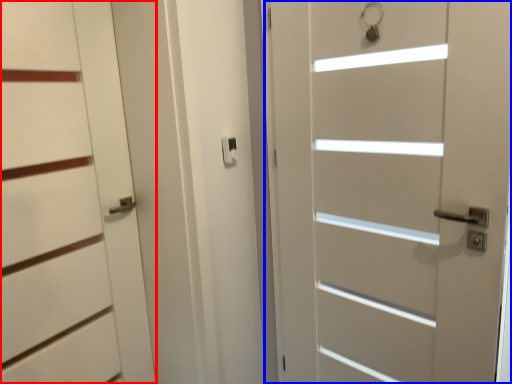
Question: Among these objects, which one is nearest to the camera, door (highlighted by a red box) or door (highlighted by a blue box)?

Choices:
 (A) door
 (B) door

Answer: (B)